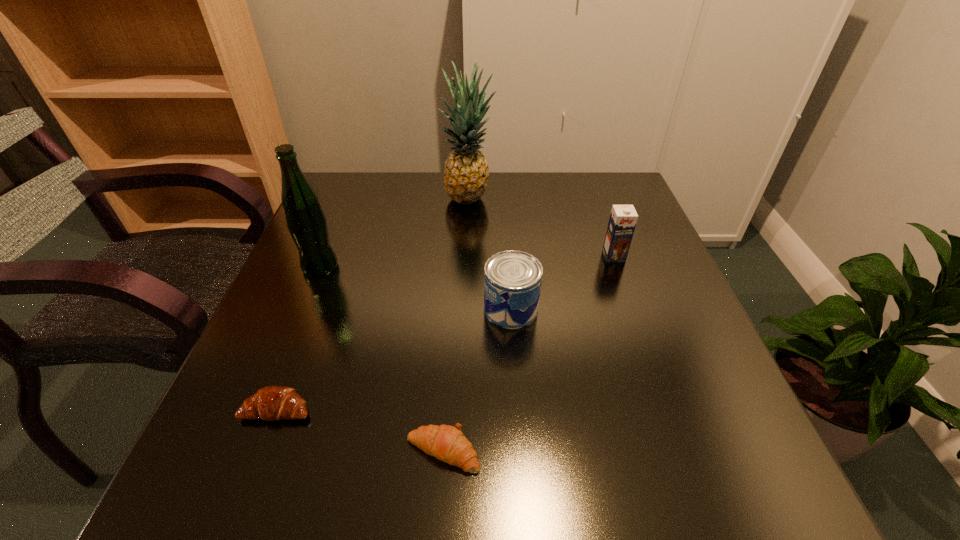
You are a GUI agent. You are given a task and a screenshot of the screen. Output one action in this format:
    pyautogui.click(x=<x>, y=<y>)
    Task: Click on the free area in between the chocolate milk and the tallest object
    
    Given the screenshot: What is the action you would take?
    pyautogui.click(x=541, y=227)

Point out which object is positioned as the fourth nearest to the farther crescent roll. Please provide its 2D coordinates. Your answer should be formatted as a tuple, i.e. [(x, y)], where the tuple contains the x and y coordinates of a point satisfying the conditions above.

[(466, 172)]

I want to click on object that is the third closest one to the can, so tap(466, 172).

The height and width of the screenshot is (540, 960). I want to click on vacant area in the image that satisfies the following two spatial constraints: 1. on the front label of the fourth shortest object; 2. on the front label of the third shortest object, so click(x=633, y=308).

Locate an element on the screen. vacant area that satisfies the following two spatial constraints: 1. on the back side of the farthest object; 2. on the left side of the fifth shortest object is located at coordinates (348, 199).